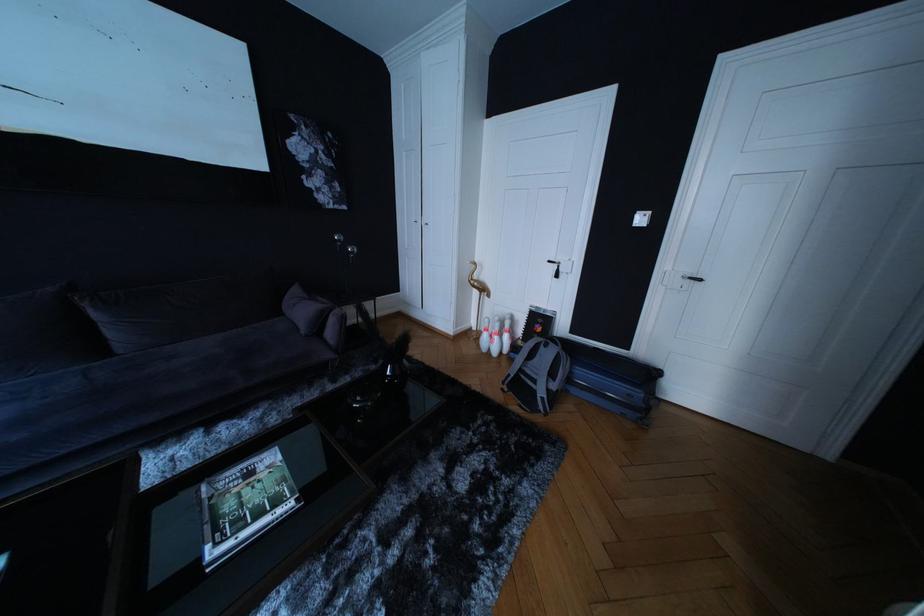
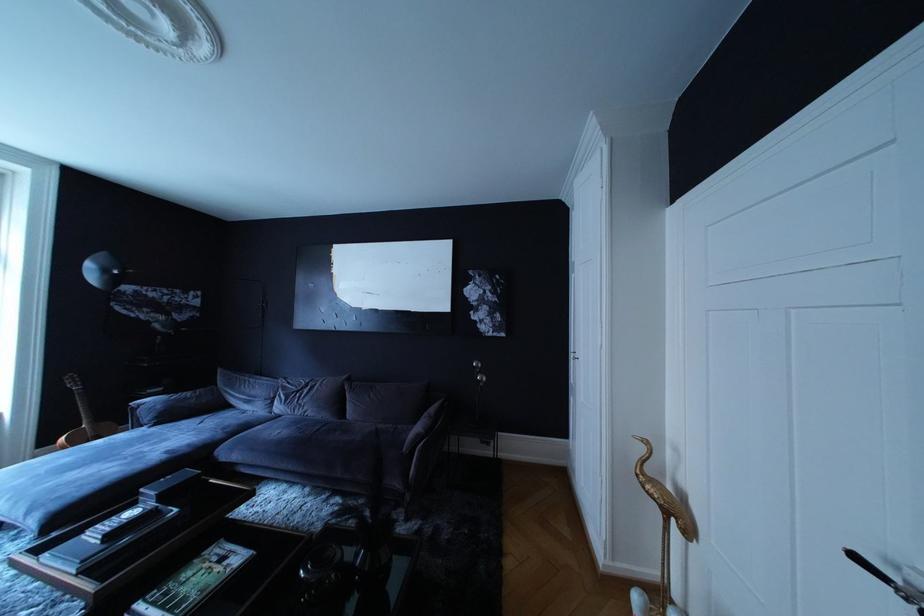
Find the pixel in the second image that matches the point at 558,268 in the first image.

(867, 565)